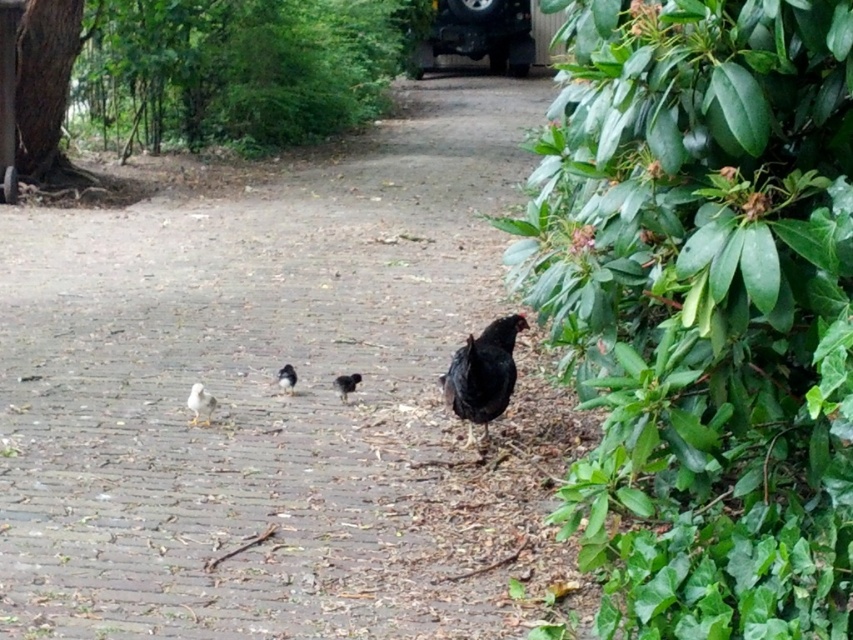
Who is more distant from viewer, (38, 38) or (489, 401)?

Point (38, 38)

Does green leafy tree at upper left have a smaller size compared to black matte chicken at right?

Correct, green leafy tree at upper left occupies less space than black matte chicken at right.

Locate an element on the screen. Image resolution: width=853 pixels, height=640 pixels. green leafy tree at upper left is located at coordinates (193, 76).

Can you confirm if green leafy tree at upper left is positioned to the right of white fluffy chicken at lower left?

Yes, green leafy tree at upper left is to the right of white fluffy chicken at lower left.

Between green leafy tree at upper left and white fluffy chicken at lower left, which one is positioned higher?

green leafy tree at upper left is higher up.

Does point (138, 24) come farther from viewer compared to point (199, 392)?

Yes, point (138, 24) is farther from viewer.

Identify the location of green leafy tree at upper left. (193, 76).

Between point (78, 461) and point (280, 83), which one is positioned in front?

Point (78, 461) is more forward.

The image size is (853, 640). I want to click on brick pavement at center, so click(276, 397).